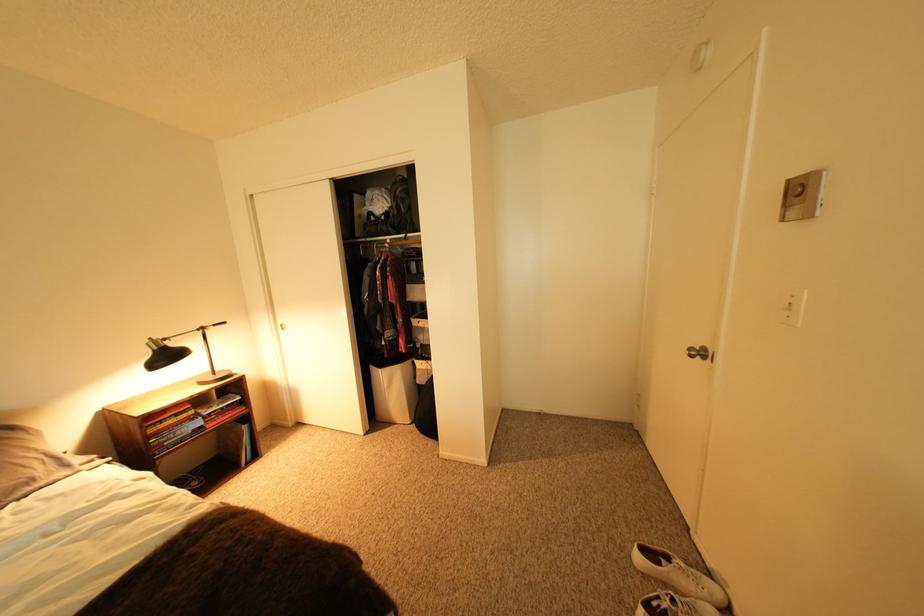
Find the location of a particular element. silver doorknob is located at coordinates (698, 352).